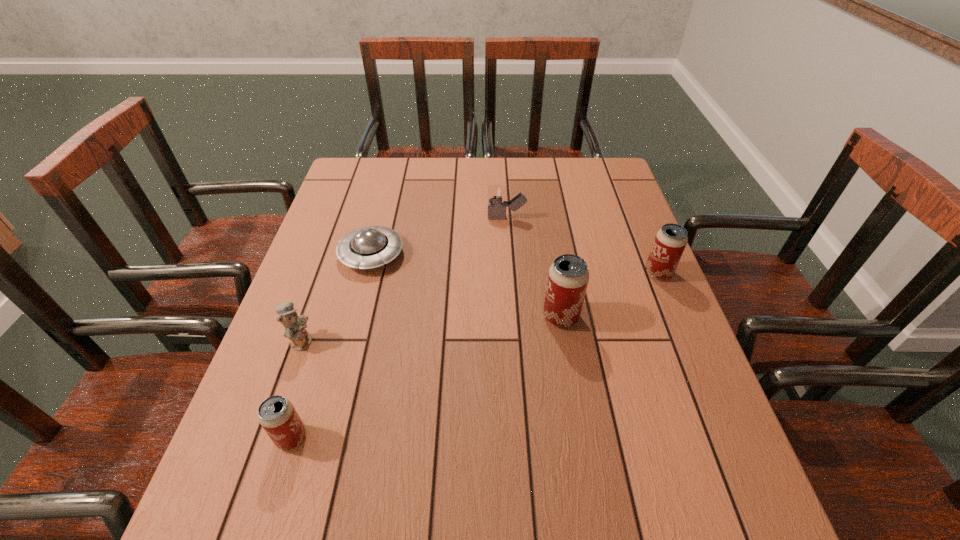
Locate which beer can is the third closest to the teddy bear. Please provide its 2D coordinates. Your answer should be formatted as a tuple, i.e. [(x, y)], where the tuple contains the x and y coordinates of a point satisfying the conditions above.

[(670, 241)]

Locate which beer can ranks third in proximity to the teddy bear. Please provide its 2D coordinates. Your answer should be formatted as a tuple, i.e. [(x, y)], where the tuple contains the x and y coordinates of a point satisfying the conditions above.

[(670, 241)]

Locate an element on the screen. vacant space that satisfies the following two spatial constraints: 1. on the back side of the second tallest object; 2. on the right side of the fifth object from left to right is located at coordinates (553, 273).

Locate an element on the screen. vacant space that satisfies the following two spatial constraints: 1. on the front side of the igniter; 2. on the front-facing side of the teddy bear is located at coordinates (515, 341).